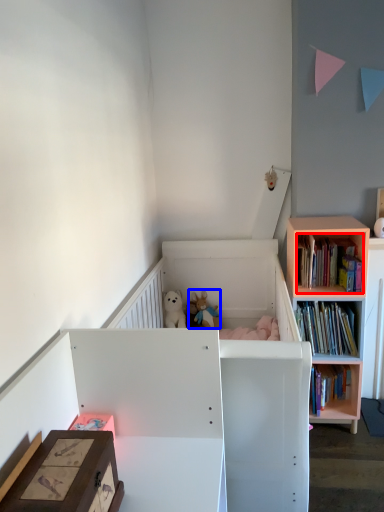
Question: Which object is closer to the camera taking this photo, book (highlighted by a red box) or toy (highlighted by a blue box)?

Choices:
 (A) book
 (B) toy

Answer: (A)